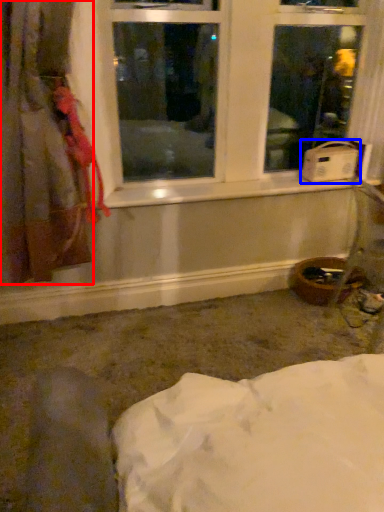
Question: Which object appears farthest to the camera in this image, curtain (highlighted by a red box) or water heater (highlighted by a blue box)?

Choices:
 (A) curtain
 (B) water heater

Answer: (B)